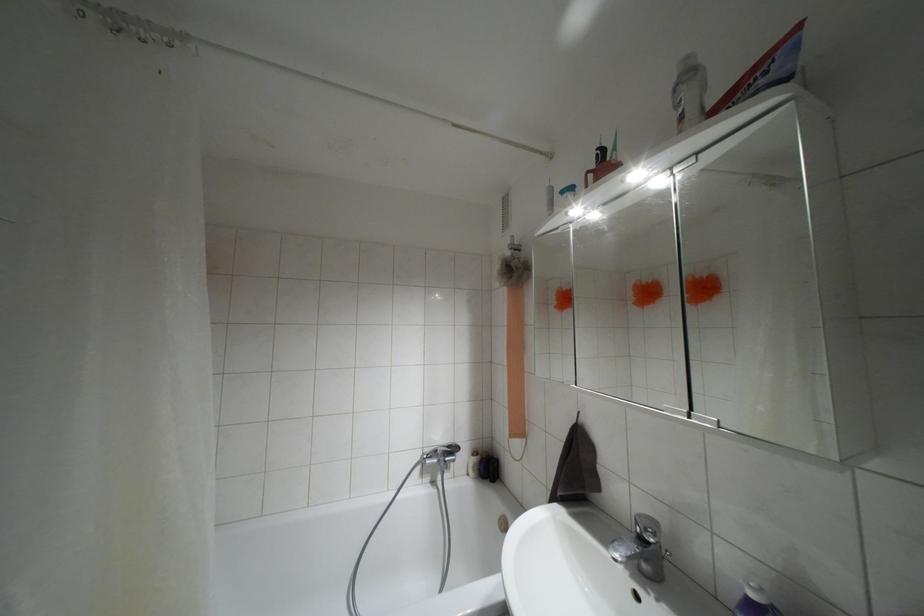
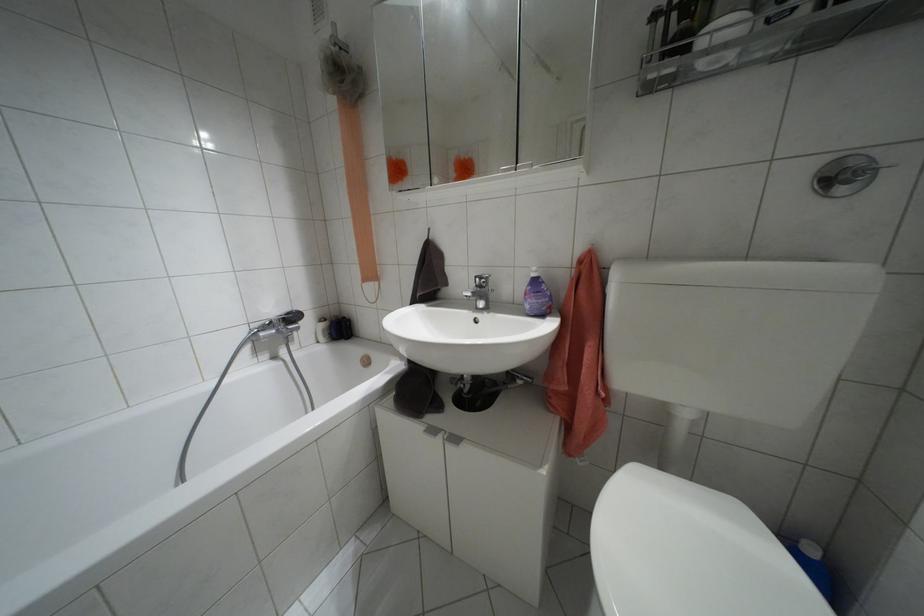
Find the pixel in the second image that matches point 447,446 in the first image.

(286, 313)